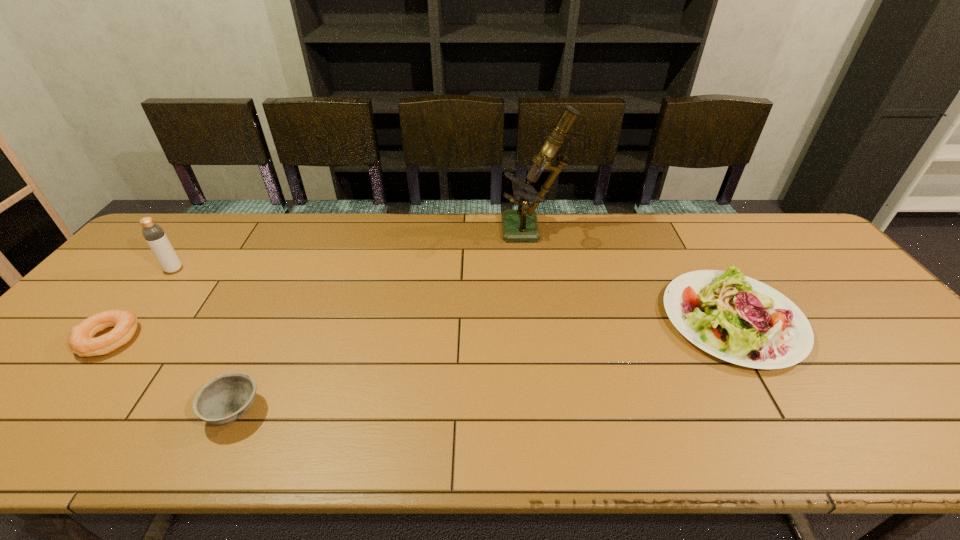
Where is `vacant space at the far edge of the desktop`? vacant space at the far edge of the desktop is located at coordinates (405, 233).

Locate an element on the screen. The width and height of the screenshot is (960, 540). vacant space at the near edge of the desktop is located at coordinates (35, 449).

At what (x,y) coordinates should I click in order to perform the action: click on vacant space at the right edge of the desktop. Please return your answer as a coordinate pair (x, y). The image size is (960, 540). Looking at the image, I should click on (837, 307).

Where is `blank space at the far left corner`? Image resolution: width=960 pixels, height=540 pixels. blank space at the far left corner is located at coordinates (197, 217).

Where is `vacant area at the far right corner`? This screenshot has width=960, height=540. vacant area at the far right corner is located at coordinates (780, 233).

Where is `free area in between the third shortest object and the second tallest object`? This screenshot has width=960, height=540. free area in between the third shortest object and the second tallest object is located at coordinates (453, 294).

Identify the location of blank region between the fourth object from left to right and the third shortest object. (633, 275).

Identify the location of free space between the tallest object and the fourth nearest object. (353, 251).

Where is `empty space that is in between the bowl and the salad plate`? empty space that is in between the bowl and the salad plate is located at coordinates (484, 365).

Identify the location of free spot between the salad plate and the second shortest object. The height and width of the screenshot is (540, 960). (484, 365).